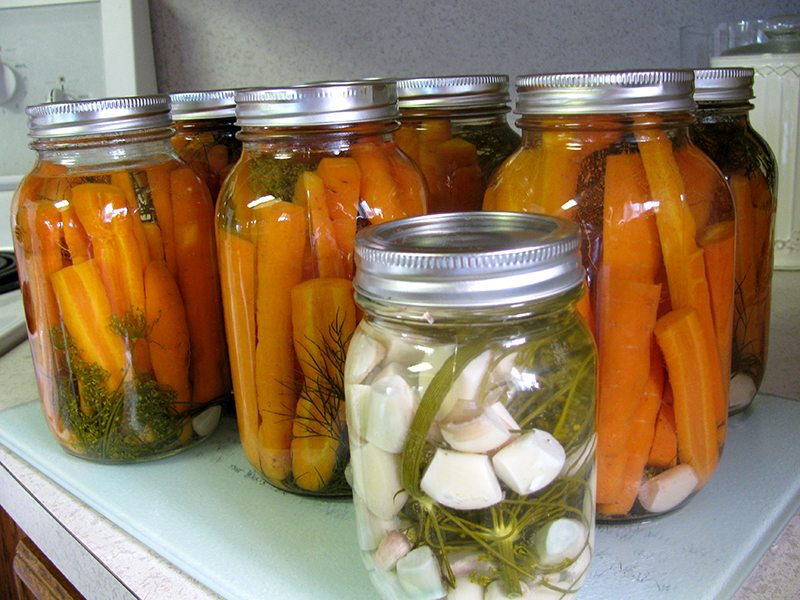
Identify the location of cabinet. (34, 585).